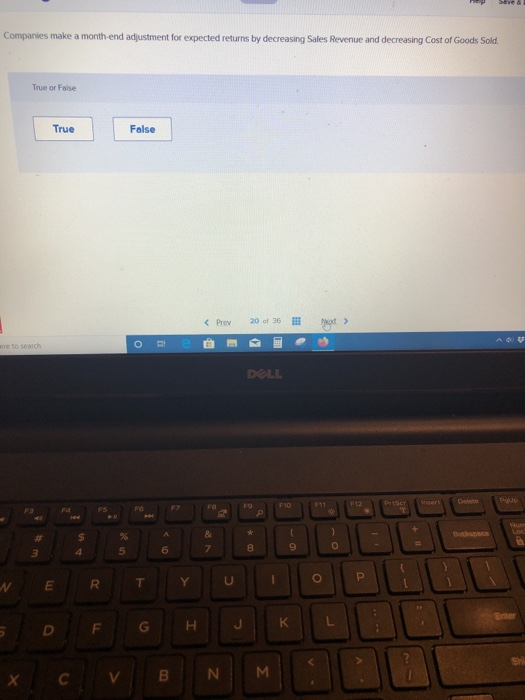
The height and width of the screenshot is (700, 525). Find the location of `page up button on the top right of the keyboard`. page up button on the top right of the keyboard is located at coordinates (508, 502).